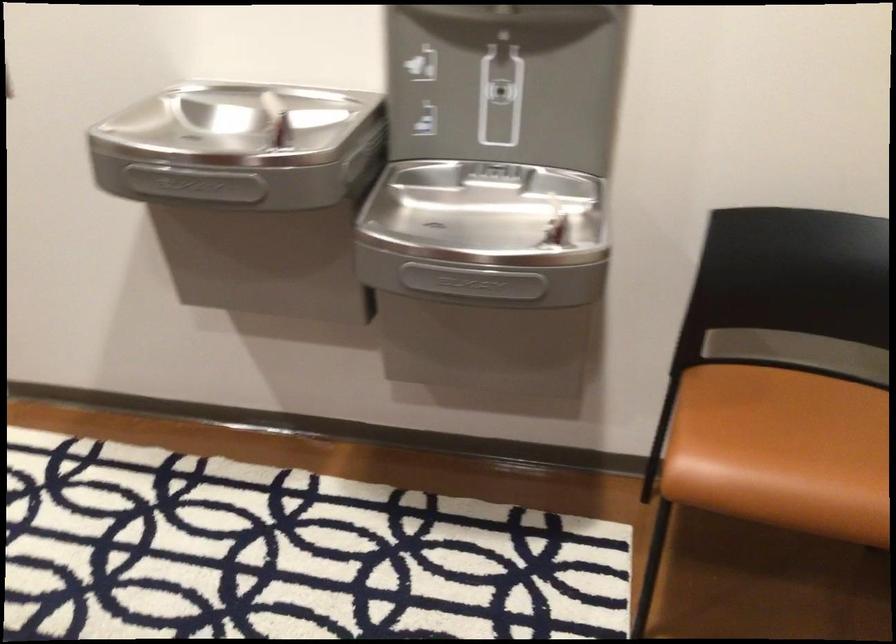
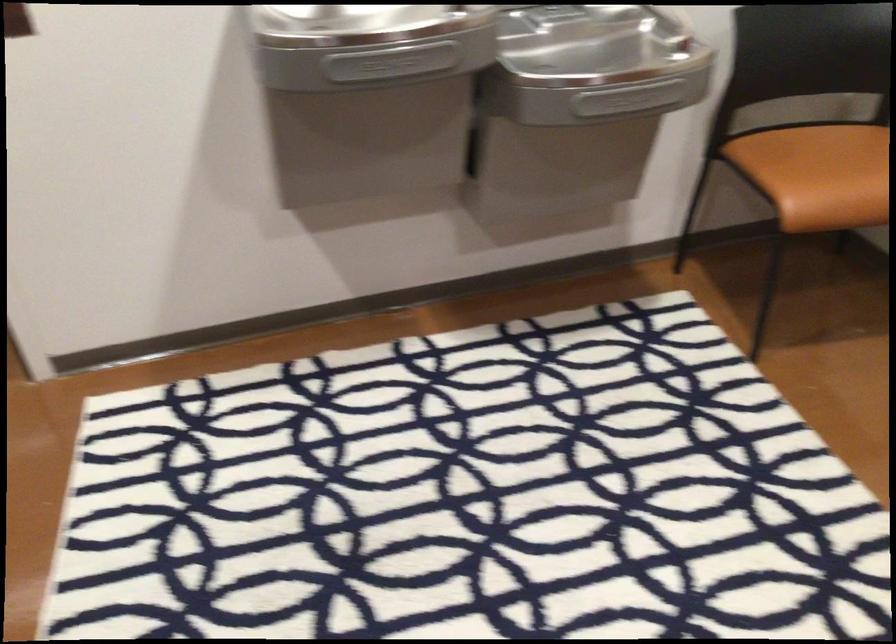
In the second image, find the point that corresponds to (754,442) in the first image.

(821, 174)